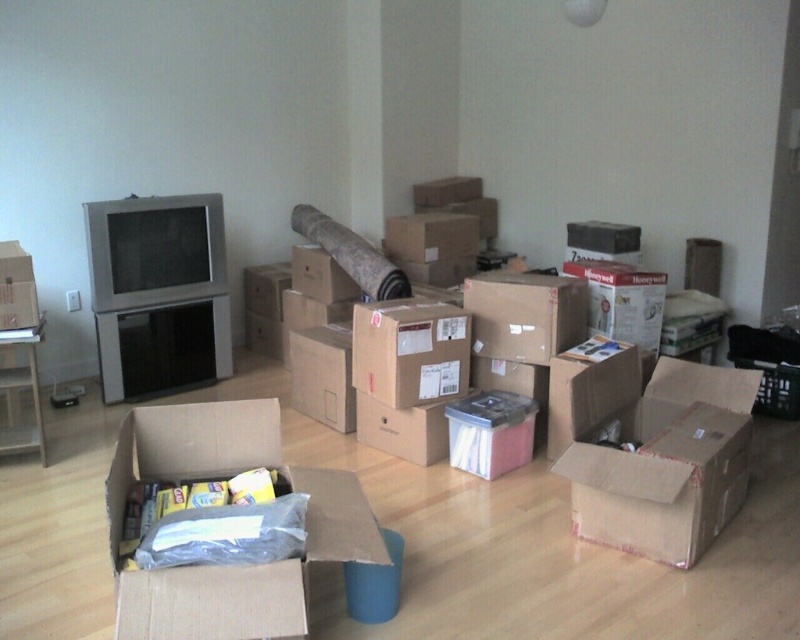
Between cardboard box at center and matte cardboard box at left, which one has less height?

Standing shorter between the two is matte cardboard box at left.

Can you confirm if cardboard box at center is shorter than matte cardboard box at left?

In fact, cardboard box at center may be taller than matte cardboard box at left.

Is point (245, 576) positioned in front of point (8, 262)?

Yes, it is in front of point (8, 262).

The width and height of the screenshot is (800, 640). I want to click on cardboard box at center, so click(x=233, y=566).